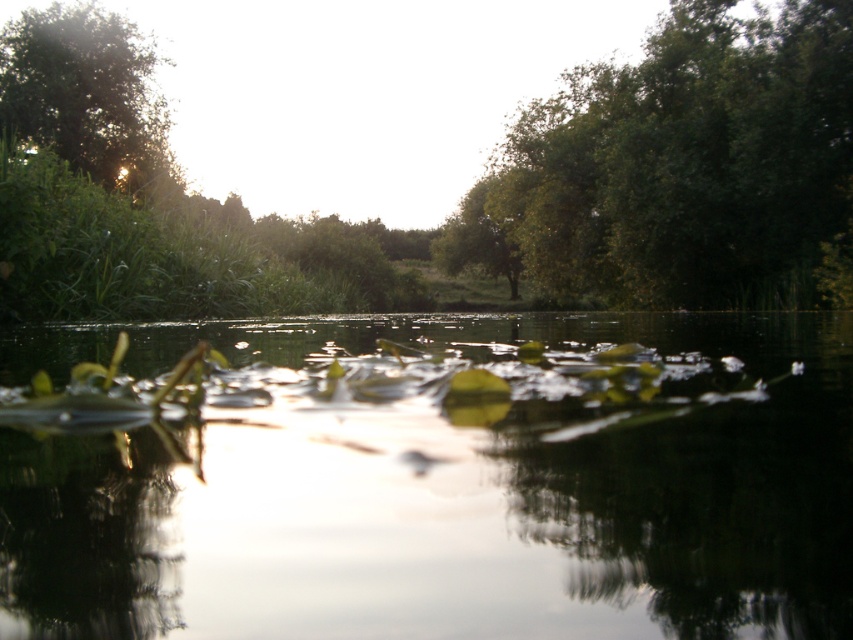
You are planning to install a small garden path between the green leafy tree at upper center and the green grass at upper left. What is the minimum length of the path required to connect both areas?

The minimum length of the path required to connect the green leafy tree at upper center and the green grass at upper left is 13.90 meters, as they are 13.90 meters apart from each other.

You are a botanist examining the image of a pond. You need to determine which object has a greater width between the green leafy plants at center and the green leafy tree at upper left. Based on the scene, which one is wider?

The green leafy plants at center has a greater width compared to the green leafy tree at upper left.

You are standing at the edge of the water and want to pick up the green leafy plants at center and the green leafy tree at upper center. Which one can you reach without moving your position?

The green leafy plants at center can be reached without moving because they are closer to the viewer compared to the green leafy tree at upper center which is further away.